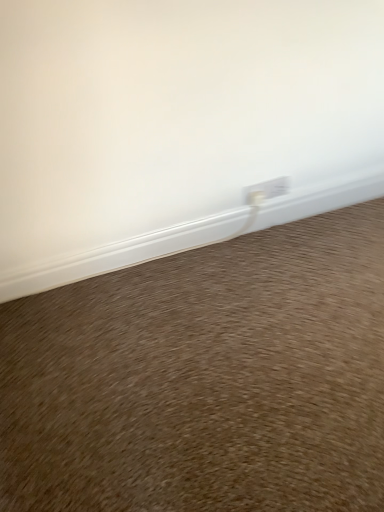
Question: Can you confirm if brown carpet at lower center is smaller than white plastic window sill at lower center?

Choices:
 (A) no
 (B) yes

Answer: (A)

Question: Is brown carpet at lower center next to white plastic window sill at lower center?

Choices:
 (A) yes
 (B) no

Answer: (B)

Question: From the image's perspective, is brown carpet at lower center under white plastic window sill at lower center?

Choices:
 (A) no
 (B) yes

Answer: (B)

Question: Is brown carpet at lower center bigger than white plastic window sill at lower center?

Choices:
 (A) yes
 (B) no

Answer: (A)

Question: Considering the relative sizes of brown carpet at lower center and white plastic window sill at lower center in the image provided, is brown carpet at lower center shorter than white plastic window sill at lower center?

Choices:
 (A) no
 (B) yes

Answer: (B)

Question: Can you confirm if brown carpet at lower center is wider than white plastic window sill at lower center?

Choices:
 (A) yes
 (B) no

Answer: (A)

Question: Is there a large distance between white plastic window sill at lower center and brown carpet at lower center?

Choices:
 (A) yes
 (B) no

Answer: (B)

Question: Does white plastic window sill at lower center have a greater width compared to brown carpet at lower center?

Choices:
 (A) yes
 (B) no

Answer: (B)

Question: From the image's perspective, is white plastic window sill at lower center under brown carpet at lower center?

Choices:
 (A) no
 (B) yes

Answer: (A)

Question: Is brown carpet at lower center completely or partially inside white plastic window sill at lower center?

Choices:
 (A) no
 (B) yes

Answer: (A)

Question: Is white plastic window sill at lower center looking in the opposite direction of brown carpet at lower center?

Choices:
 (A) no
 (B) yes

Answer: (A)

Question: Can you see white plastic window sill at lower center touching brown carpet at lower center?

Choices:
 (A) yes
 (B) no

Answer: (B)

Question: Considering the positions of brown carpet at lower center and white plastic window sill at lower center in the image, is brown carpet at lower center bigger or smaller than white plastic window sill at lower center?

Choices:
 (A) small
 (B) big

Answer: (B)